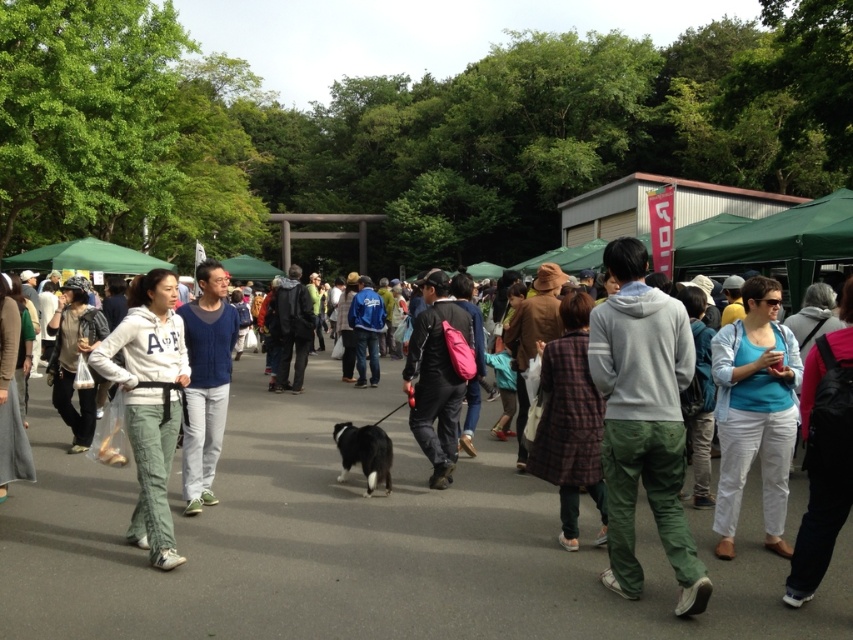
Question: Estimate the real-world distances between objects in this image. Which object is farther from the black fur dog at center?

Choices:
 (A) matte blue shirt at center
 (B) matte blue sweater at center
 (C) pink fabric backpack at center

Answer: (A)

Question: Which object is the farthest from the black fur dog at center?

Choices:
 (A) matte blue sweater at center
 (B) matte blue shirt at center

Answer: (B)

Question: Which point is closer to the camera?

Choices:
 (A) black fur dog at center
 (B) pink fabric backpack at center

Answer: (A)

Question: Is matte blue shirt at center closer to camera compared to pink fabric backpack at center?

Choices:
 (A) no
 (B) yes

Answer: (B)

Question: Does white cotton hoodie at center have a larger size compared to matte blue sweater at center?

Choices:
 (A) no
 (B) yes

Answer: (B)

Question: Can you confirm if matte blue shirt at center is positioned above white cotton hoodie at center?

Choices:
 (A) yes
 (B) no

Answer: (A)